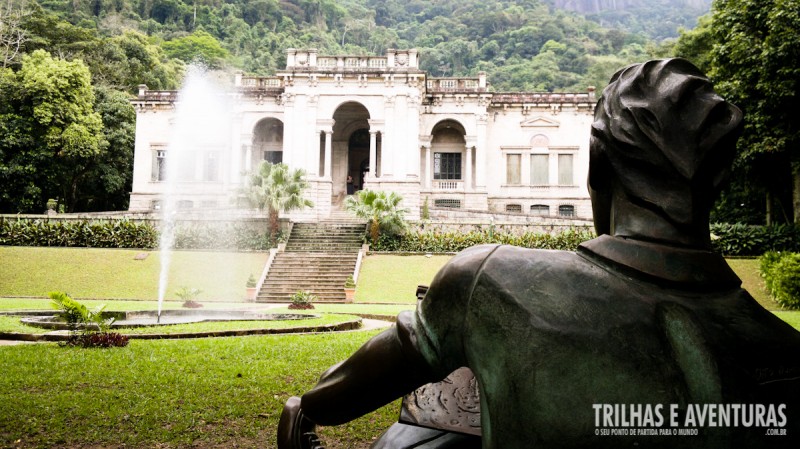
Locate an element on the screen. top of archway around the door in the background is located at coordinates (358, 122).